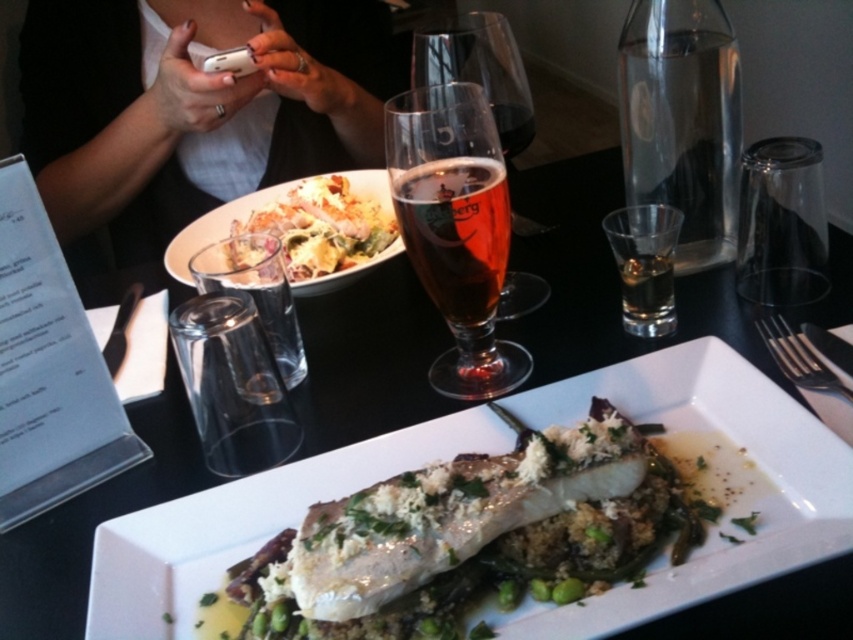
You are a waiter in a busy restaurant and need to deliver a drink to a customer. You see the translucent glass beer at center and the transparent glass carafe at upper right. Which one is closer to the customer sitting at the table?

The translucent glass beer at center is closer to the customer sitting at the table because it is located below the transparent glass carafe at upper right, meaning it is positioned lower and nearer to the customer.

You are a waiter at this restaurant and need to place a new drink order on the table. The drink must be placed in a spot that is higher than the translucent glass at center but lower than the white fabric shirt at upper left. Is there a suitable location on the table for this?

The white fabric shirt at upper left has a greater height compared to the translucent glass at center, so the area between their heights would be suitable for placing the drink order.

Looking at this image, you are a waiter trying to place a new drink order on the table. The table has limited space between the existing items. Which of the two glasses, the amber glass beer at center or the translucent glass at center, would require more space due to its width?

The amber glass beer at center might be wider than the translucent glass at center, so it would require more space due to its width.